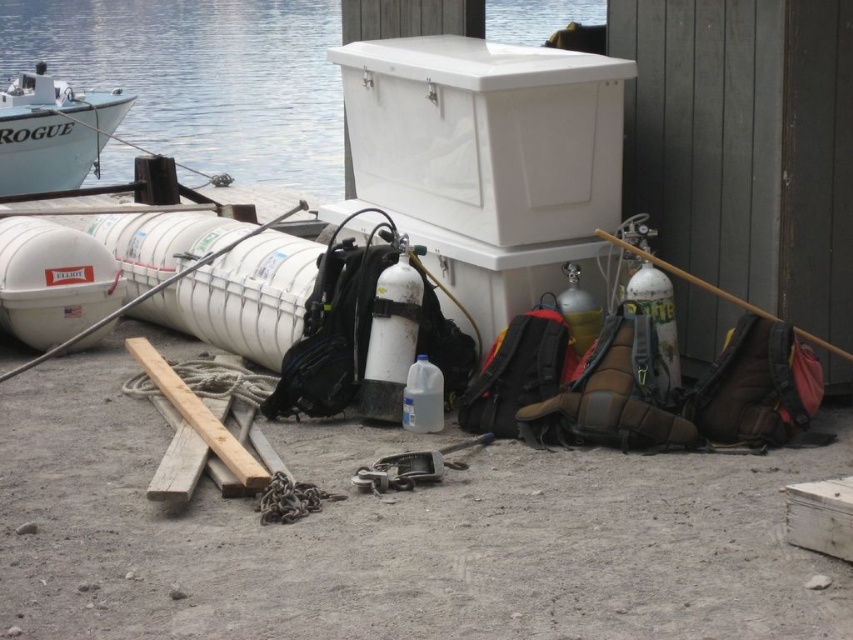
Question: Does white glossy water at upper left appear on the left side of wooden planks at center?

Choices:
 (A) no
 (B) yes

Answer: (A)

Question: Which point appears closest to the camera in this image?

Choices:
 (A) (207, 444)
 (B) (71, 300)

Answer: (A)

Question: Can you confirm if white plastic cooler at upper center is wider than white glossy boat at upper left?

Choices:
 (A) yes
 (B) no

Answer: (A)

Question: Which point is closer to the camera taking this photo?

Choices:
 (A) (506, 42)
 (B) (44, 118)

Answer: (B)

Question: Can you confirm if white plastic cooler at upper center is positioned below white matte life raft at left?

Choices:
 (A) no
 (B) yes

Answer: (A)

Question: Which object is positioned closest to the white glossy boat at upper left?

Choices:
 (A) white glossy water at upper left
 (B) white plastic cooler at upper center

Answer: (A)